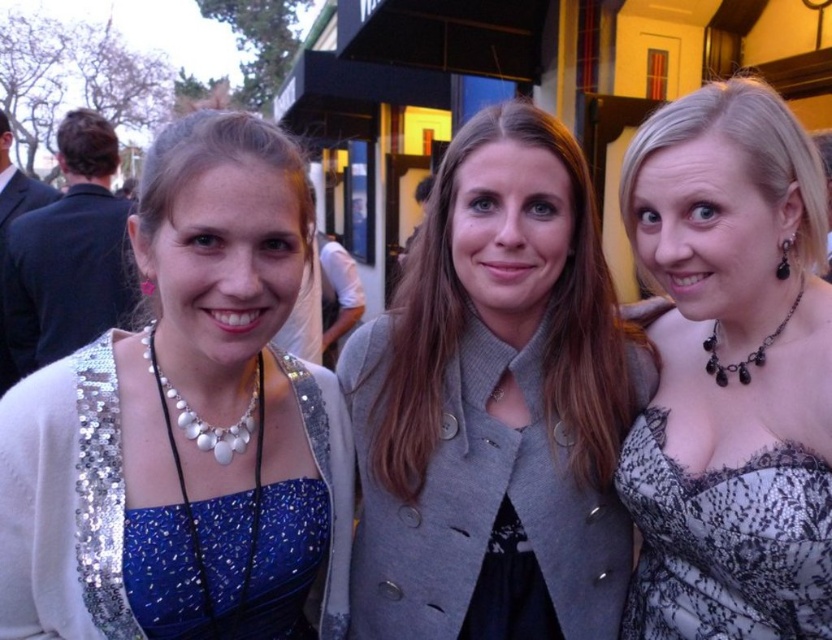
You are a photographer at the event and want to ensure all subjects are in focus. Since the blue sequined dress at left and white pearl necklace at center are at different heights, which one is taller?

The blue sequined dress at left is much taller than the white pearl necklace at center.

You are a photographer at the event and want to ensure both the blue sequined dress at left and the white pearl necklace at center are clearly visible in your shot. Which object should you focus on first to ensure proper framing?

The blue sequined dress at left is bigger than the white pearl necklace at center, so you should focus on the blue sequined dress at left first to ensure proper framing.